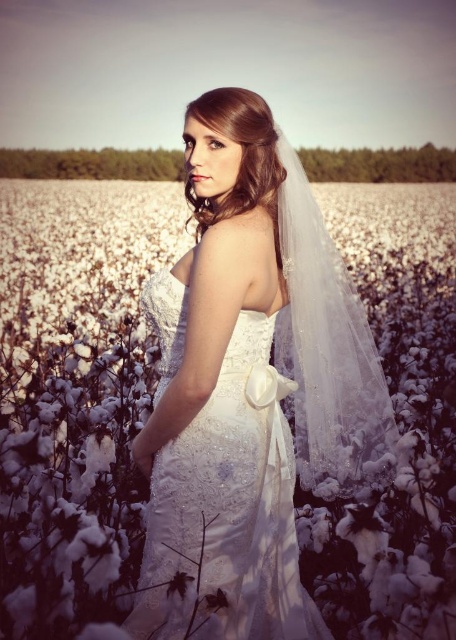
You are a photographer planning to capture the bride in this scene. Given the white lace veil at upper center and the satin white dress at center, which one would you focus on to ensure the subject is prominent in the photo?

The white lace veil at upper center has a larger size compared to the satin white dress at center, so focusing on the white lace veil at upper center would make the subject more prominent in the photo.

You are a photographer planning to adjust the lighting for the bride in the scene. Considering the position of the white lace veil at upper center and the satin white dress at center, which object should you focus the light on first to ensure proper exposure?

The white lace veil at upper center is above the satin white dress at center, so you should focus the light on the white lace veil at upper center first to ensure proper exposure.

You are a photographer planning to capture a closeup shot of the bride. You need to decide whether to focus on the white lace veil at upper center or the satin white dress at center based on their sizes. Which object should you choose if you want to include the larger one in the frame?

The white lace veil at upper center has a larger width than the satin white dress at center, so you should focus on the white lace veil at upper center to include the larger object in the frame.